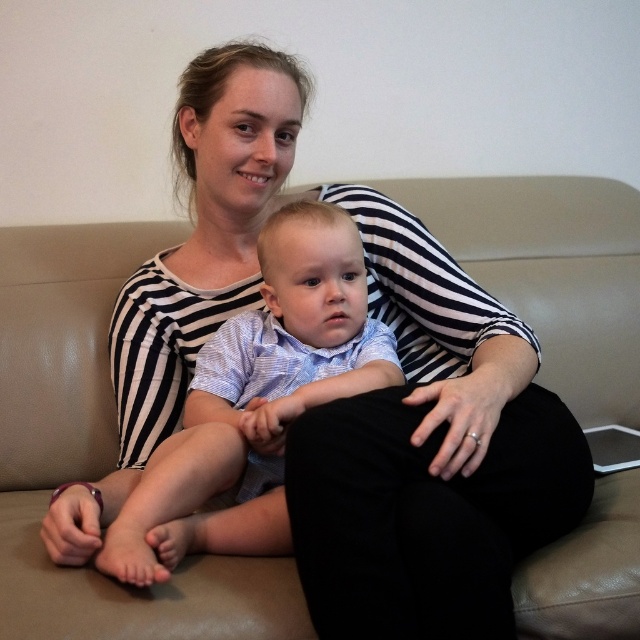
You are a furniture designer and need to determine if the light blue striped shirt at center can fit on the beige leather couch at center. Based on their sizes, can the shirt fit on the couch?

The beige leather couch at center is wider than the light blue striped shirt at center, so the shirt can fit on the couch.

You are a photographer setting up for a family portrait. You need to ensure that the beige leather couch at center and the light blue striped shirt at center are both visible in the frame. Based on their positions, which object is closer to the camera?

The beige leather couch at center is positioned over the light blue striped shirt at center, meaning it is closer to the camera.

What are the coordinates of the beige leather couch at center?

The beige leather couch at center is located at coordinates point (93, 452).